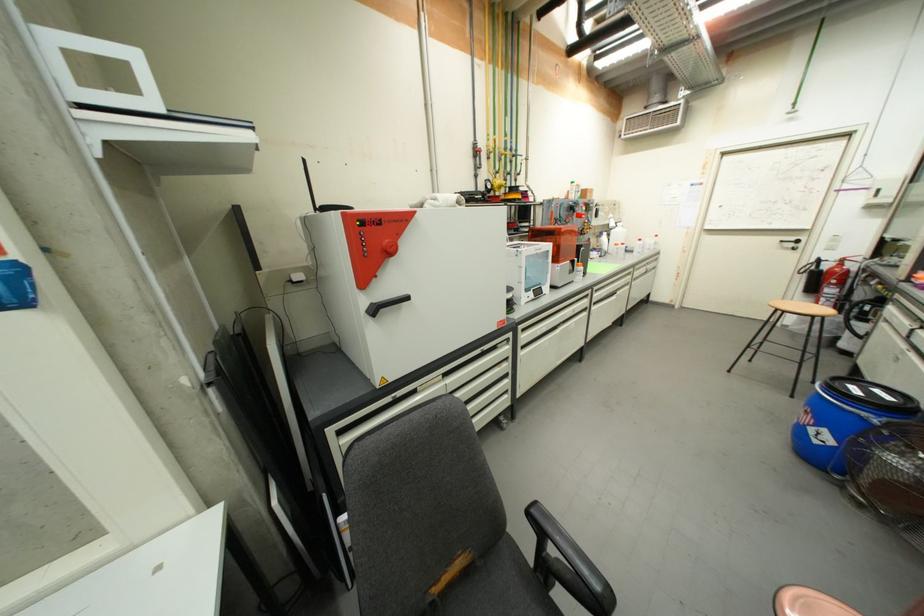
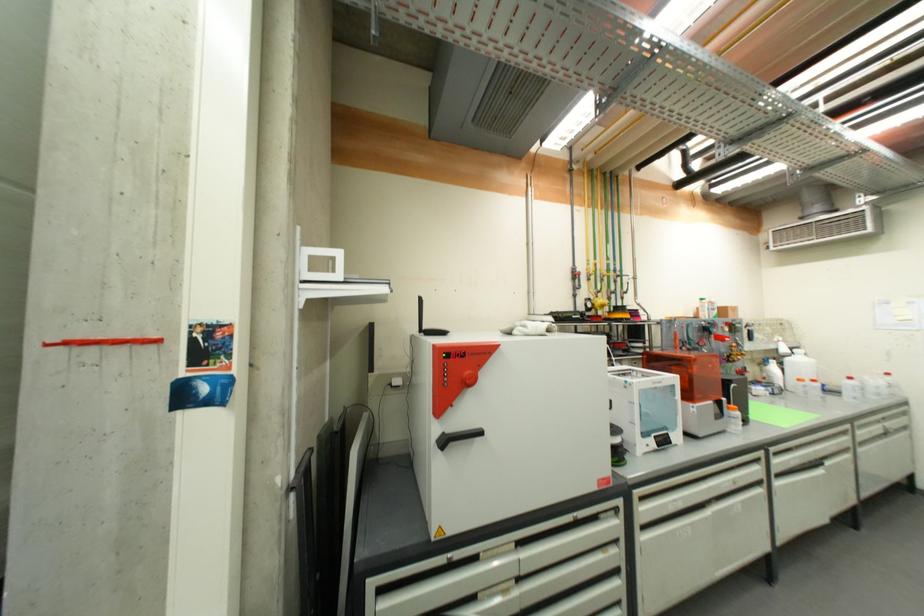
The point at (451, 377) is marked in the first image. Where is the corresponding point in the second image?

(525, 546)